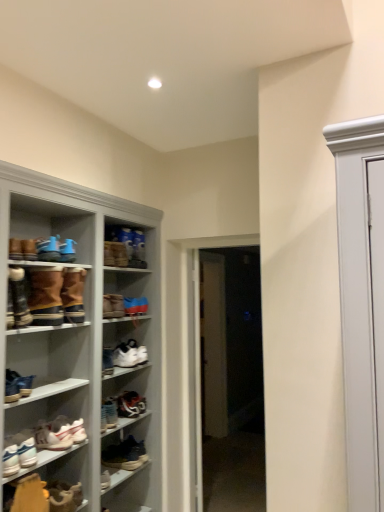
Question: Can you confirm if shiny black sneaker at center, the 10th footwear in the top-to-bottom sequence, is positioned to the left of blue suede sneakers at upper left, placed as the twelfth footwear when sorted from bottom to top?

Choices:
 (A) no
 (B) yes

Answer: (A)

Question: Is shiny black sneaker at center, the 10th footwear in the top-to-bottom sequence, bigger than blue suede sneakers at upper left, placed as the twelfth footwear when sorted from bottom to top?

Choices:
 (A) no
 (B) yes

Answer: (B)

Question: From the image's perspective, is shiny black sneaker at center, the 10th footwear in the top-to-bottom sequence, beneath blue suede sneakers at upper left, acting as the 2th footwear starting from the top?

Choices:
 (A) no
 (B) yes

Answer: (B)

Question: From a real-world perspective, is shiny black sneaker at center, the 10th footwear in the top-to-bottom sequence, positioned under blue suede sneakers at upper left, placed as the twelfth footwear when sorted from bottom to top, based on gravity?

Choices:
 (A) yes
 (B) no

Answer: (A)

Question: Is shiny black sneaker at center, the 10th footwear in the top-to-bottom sequence, in front of blue suede sneakers at upper left, acting as the 2th footwear starting from the top?

Choices:
 (A) no
 (B) yes

Answer: (A)

Question: Is shiny black sneaker at center, the fourth footwear in the bottom-to-top sequence, oriented away from blue suede sneakers at upper left, placed as the twelfth footwear when sorted from bottom to top?

Choices:
 (A) no
 (B) yes

Answer: (A)

Question: Can you confirm if white glossy door at center, arranged as the 2th door when viewed from the left, is taller than brown suede boot at center, the 3th footwear when ordered from top to bottom?

Choices:
 (A) yes
 (B) no

Answer: (A)

Question: Does white glossy door at center, marked as the 1th door in a right-to-left arrangement, have a larger size compared to brown suede boot at center, the 3th footwear when ordered from top to bottom?

Choices:
 (A) no
 (B) yes

Answer: (B)

Question: Can you confirm if white glossy door at center, marked as the 1th door in a right-to-left arrangement, is wider than brown suede boot at center, the 11th footwear when ordered from bottom to top?

Choices:
 (A) yes
 (B) no

Answer: (B)

Question: Can we say white glossy door at center, arranged as the 2th door when viewed from the left, lies outside brown suede boot at center, the 11th footwear when ordered from bottom to top?

Choices:
 (A) no
 (B) yes

Answer: (B)

Question: Is white glossy door at center, arranged as the 2th door when viewed from the left, in front of brown suede boot at center, the 3th footwear when ordered from top to bottom?

Choices:
 (A) no
 (B) yes

Answer: (A)

Question: Is white glossy door at center, marked as the 1th door in a right-to-left arrangement, oriented towards brown suede boot at center, the 3th footwear when ordered from top to bottom?

Choices:
 (A) no
 (B) yes

Answer: (A)

Question: Can you confirm if leather sneaker at lower center, which is the 13th footwear in top-to-bottom order, is wider than leather boot at lower left, the 2th footwear in the bottom-to-top sequence?

Choices:
 (A) yes
 (B) no

Answer: (B)